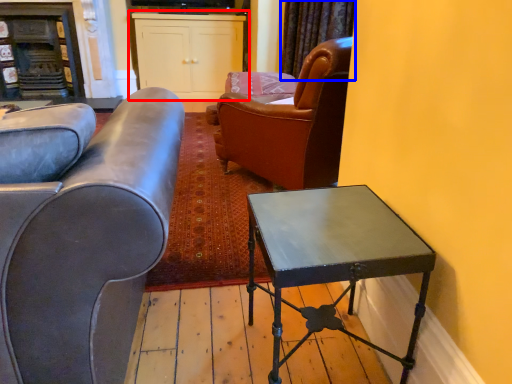
Question: Which of the following is the farthest to the observer, cabinetry (highlighted by a red box) or curtain (highlighted by a blue box)?

Choices:
 (A) cabinetry
 (B) curtain

Answer: (A)